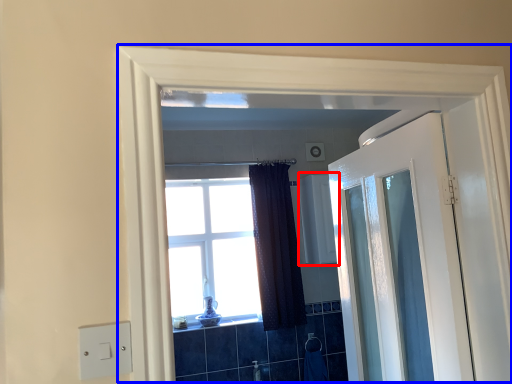
Question: Which of the following is the closest to the observer, medicine cabinet (highlighted by a red box) or window frame (highlighted by a blue box)?

Choices:
 (A) medicine cabinet
 (B) window frame

Answer: (B)